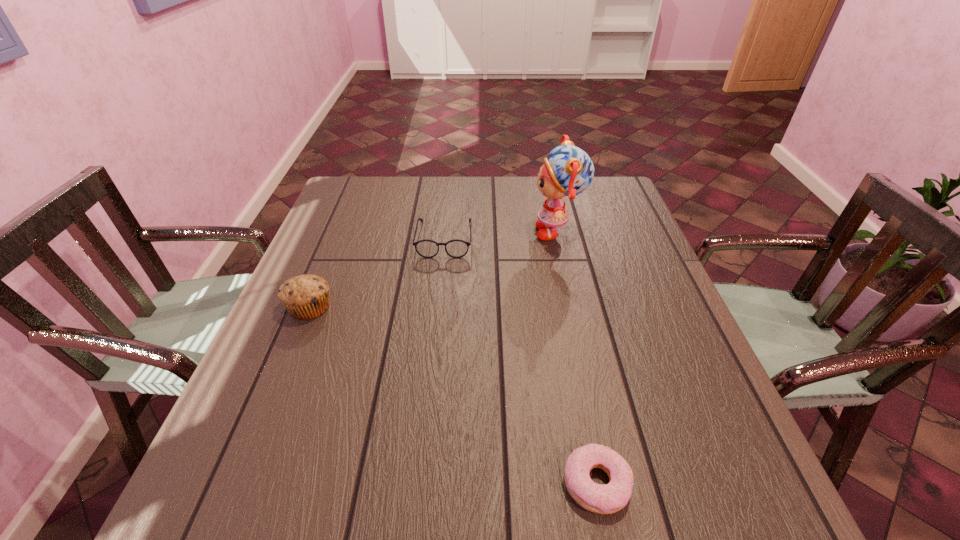
Identify the location of vacant space that's between the second shortest object and the doughnut. Image resolution: width=960 pixels, height=540 pixels. (520, 361).

Locate an element on the screen. The height and width of the screenshot is (540, 960). free point between the doughnut and the second nearest object is located at coordinates (453, 395).

Identify which object is the second nearest to the tallest object. Please provide its 2D coordinates. Your answer should be formatted as a tuple, i.e. [(x, y)], where the tuple contains the x and y coordinates of a point satisfying the conditions above.

[(305, 297)]

Where is `the second closest object to the doughnut`? This screenshot has height=540, width=960. the second closest object to the doughnut is located at coordinates [426, 248].

What are the coordinates of `free space that satisfies the following two spatial constraints: 1. on the front-facing side of the third object from right to left; 2. on the right side of the doughnut` in the screenshot? It's located at (420, 483).

Identify the location of vacant point that satisfies the following two spatial constraints: 1. on the face of the doll; 2. on the front-facing side of the second object from left to right. The width and height of the screenshot is (960, 540). (560, 239).

You are a GUI agent. You are given a task and a screenshot of the screen. Output one action in this format:
    pyautogui.click(x=<x>, y=<y>)
    Task: Click on the vacant space that satisfies the following two spatial constraints: 1. on the front-facing side of the second shortest object; 2. on the left side of the nearest object
    This screenshot has height=540, width=960.
    Given the screenshot: What is the action you would take?
    pyautogui.click(x=420, y=483)